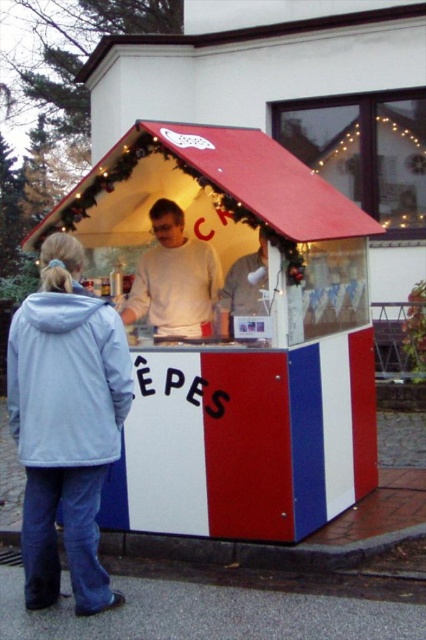
You are a customer approaching the white plastic stall at center and the white matte sweater at center. Which object will you encounter first as you walk towards the stall?

The white plastic stall at center is in front of the white matte sweater at center, so you will encounter the white plastic stall at center first.

You are a customer standing in front of the white plastic stall at center and the white matte sweater at center. Which object is taller?

The white plastic stall at center is taller than the white matte sweater at center.

Please describe the position of the white plastic stall at center in terms of coordinates within the image frame. Use the coordinate system where the bottom left corner is the origin point, and the top right corner is the maximum point.

The white plastic stall at center is located at coordinates approximately 0.534 on the x axis and 0.566 on the y axis within the image frame.